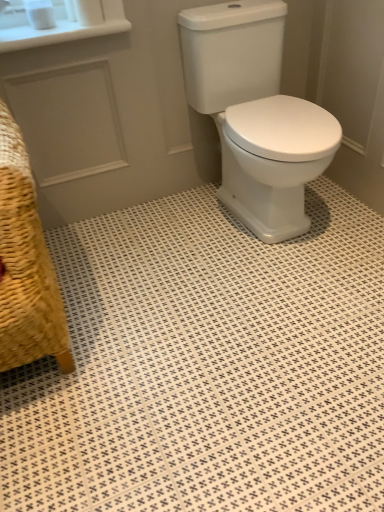
Question: Is white matte toilet paper at upper left, which is the 2th toilet paper in left-to-right order, not within white glossy porcelain at center?

Choices:
 (A) yes
 (B) no

Answer: (A)

Question: Does white matte toilet paper at upper left, acting as the first toilet paper starting from the right, lie behind white glossy porcelain at center?

Choices:
 (A) yes
 (B) no

Answer: (A)

Question: From a real-world perspective, is white matte toilet paper at upper left, which is the 2th toilet paper in left-to-right order, over white glossy porcelain at center?

Choices:
 (A) yes
 (B) no

Answer: (A)

Question: Considering the relative sizes of white matte toilet paper at upper left, acting as the first toilet paper starting from the right, and white glossy porcelain at center in the image provided, is white matte toilet paper at upper left, acting as the first toilet paper starting from the right, wider than white glossy porcelain at center?

Choices:
 (A) no
 (B) yes

Answer: (A)

Question: Is white glossy ceramic tile at center wider or thinner than white glossy porcelain at center?

Choices:
 (A) wide
 (B) thin

Answer: (A)

Question: Visually, is white glossy ceramic tile at center positioned to the left or to the right of white glossy porcelain at center?

Choices:
 (A) right
 (B) left

Answer: (B)

Question: From a real-world perspective, is white glossy ceramic tile at center above or below white glossy porcelain at center?

Choices:
 (A) below
 (B) above

Answer: (A)

Question: Is white glossy ceramic tile at center in front of or behind white glossy porcelain at center in the image?

Choices:
 (A) front
 (B) behind

Answer: (A)

Question: From the image's perspective, is woven straw armchair at lower left positioned above or below white matte toilet paper at upper left, which is the 2th toilet paper in left-to-right order?

Choices:
 (A) above
 (B) below

Answer: (B)

Question: From a real-world perspective, relative to white matte toilet paper at upper left, which is the 2th toilet paper in left-to-right order, is woven straw armchair at lower left vertically above or below?

Choices:
 (A) below
 (B) above

Answer: (A)

Question: Is point (16, 215) closer or farther from the camera than point (81, 8)?

Choices:
 (A) farther
 (B) closer

Answer: (B)

Question: Is woven straw armchair at lower left taller or shorter than white matte toilet paper at upper left, acting as the first toilet paper starting from the right?

Choices:
 (A) short
 (B) tall

Answer: (B)

Question: Choose the correct answer: Is white glossy ceramic tile at center inside woven straw armchair at lower left or outside it?

Choices:
 (A) outside
 (B) inside

Answer: (A)

Question: From a real-world perspective, is white glossy ceramic tile at center above or below woven straw armchair at lower left?

Choices:
 (A) below
 (B) above

Answer: (A)